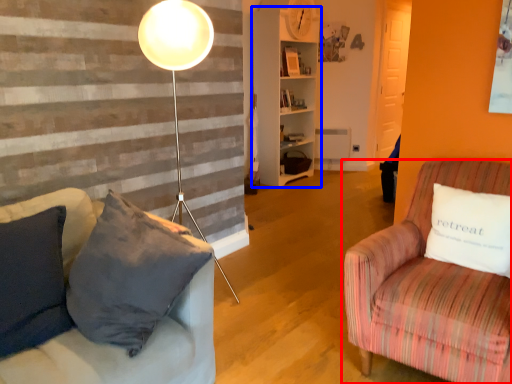
Question: Among these objects, which one is farthest to the camera, studio couch (highlighted by a red box) or shelf (highlighted by a blue box)?

Choices:
 (A) studio couch
 (B) shelf

Answer: (B)